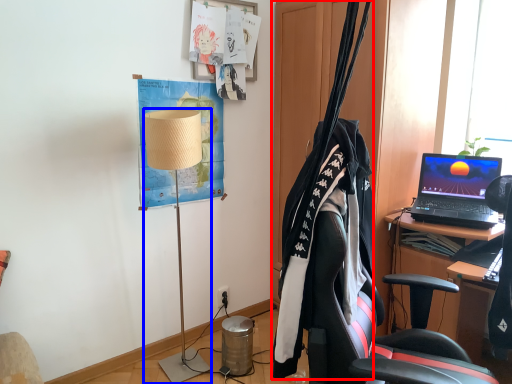
Question: Among these objects, which one is farthest to the camera, clothesline (highlighted by a red box) or lamp (highlighted by a blue box)?

Choices:
 (A) clothesline
 (B) lamp

Answer: (B)